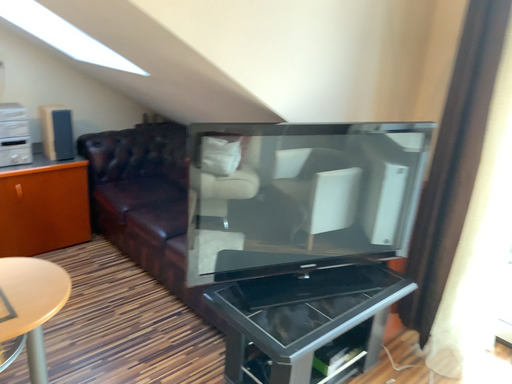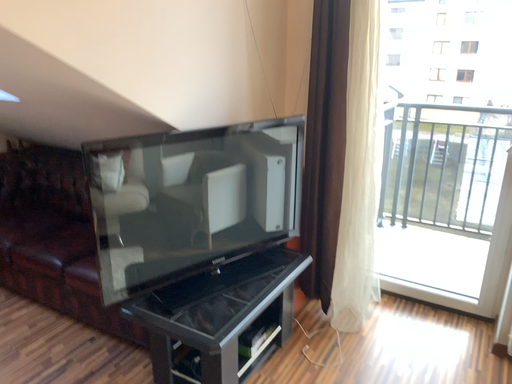
Question: Which way did the camera rotate in the video?

Choices:
 (A) rotated right
 (B) rotated left

Answer: (A)